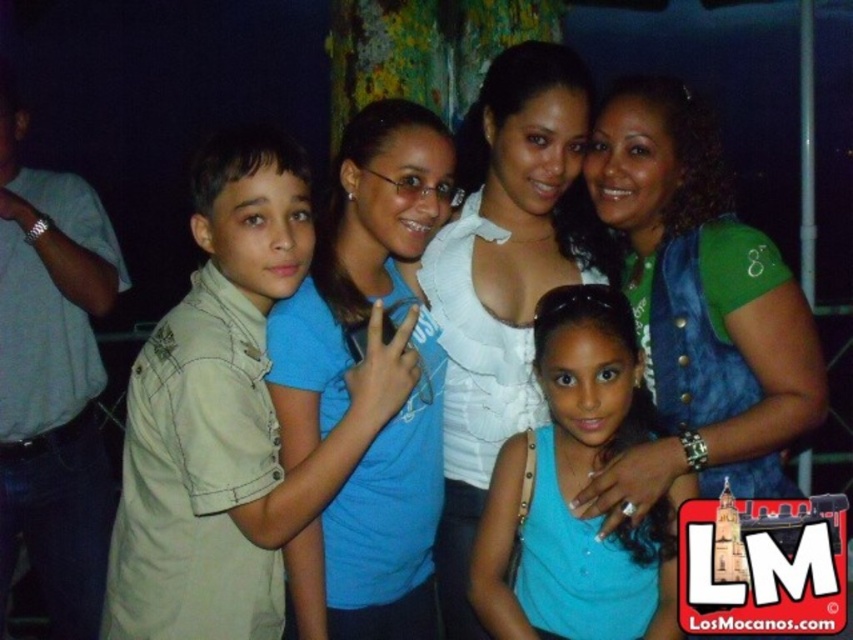
You are a photographer trying to adjust the lighting for a photo shoot. You notice the green denim vest at upper right and the white ruffled blouse at center. Which clothing item should you focus your spotlight on to ensure it stands out more due to its height?

The white ruffled blouse at center is taller than the green denim vest at upper right, so focusing the spotlight on the white ruffled blouse at center would make it stand out more due to its height.

You are a photographer trying to adjust the lighting for a group photo. You notice the blue cotton shirt at center and the white ruffled blouse at center. Which clothing item is located to the left of the other?

The blue cotton shirt at center is positioned on the left side of the white ruffled blouse at center.

You are a photographer trying to adjust the lighting for the group photo. Since the beige cotton shirt at left is much taller than the green denim vest at upper right, which object should you focus the light on to ensure both are well lit?

The beige cotton shirt at left is much taller than the green denim vest at upper right, so you should focus the light on the beige cotton shirt at left to ensure it is well lit.